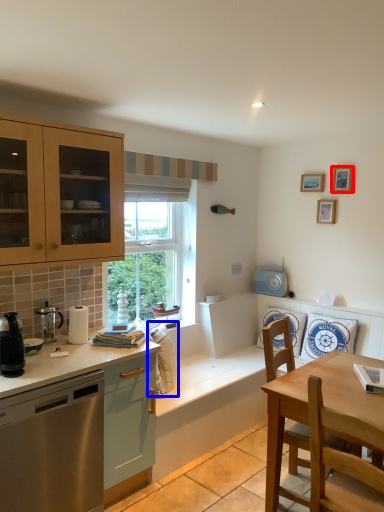
Question: Which object is closer to the camera taking this photo, picture frame (highlighted by a red box) or appliance (highlighted by a blue box)?

Choices:
 (A) picture frame
 (B) appliance

Answer: (B)